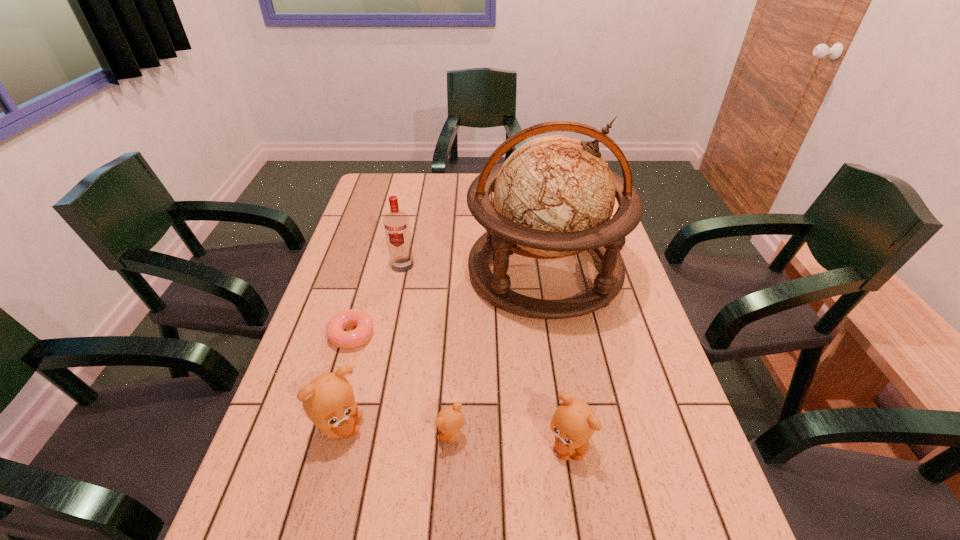
Locate an element on the screen. This screenshot has height=540, width=960. vacant space at the right edge of the desktop is located at coordinates (623, 298).

Locate an element on the screen. vacant space at the far left corner is located at coordinates (360, 200).

I want to click on unoccupied position between the tallest object and the second teddy bear from left to right, so click(498, 354).

Where is `vacant space that is in between the second shortest teddy bear and the vodka`? vacant space that is in between the second shortest teddy bear and the vodka is located at coordinates (486, 355).

The image size is (960, 540). In order to click on free area in between the second shortest object and the leftmost teddy bear in this screenshot , I will do `click(396, 431)`.

The width and height of the screenshot is (960, 540). I want to click on vacant area that lies between the leftmost teddy bear and the fifth tallest object, so click(x=396, y=431).

The image size is (960, 540). In order to click on free spot between the leftmost teddy bear and the second teddy bear from left to right in this screenshot , I will do `click(396, 431)`.

Where is `vacant area that lies between the globe and the doughnut`? This screenshot has width=960, height=540. vacant area that lies between the globe and the doughnut is located at coordinates (448, 303).

Locate an element on the screen. The height and width of the screenshot is (540, 960). free spot between the third shortest object and the vodka is located at coordinates (486, 355).

You are a GUI agent. You are given a task and a screenshot of the screen. Output one action in this format:
    pyautogui.click(x=<x>, y=<y>)
    Task: Click on the vacant region between the doughnut and the rightmost teddy bear
    The width and height of the screenshot is (960, 540).
    Given the screenshot: What is the action you would take?
    pyautogui.click(x=460, y=389)